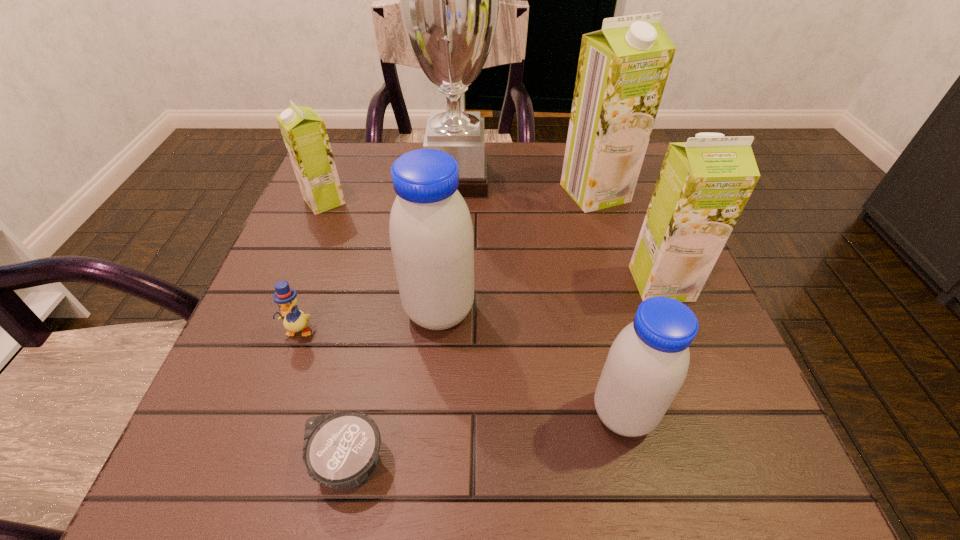
This screenshot has width=960, height=540. Identify the location of free space that satisfies the following two spatial constraints: 1. at the front view of the right blue soya milk; 2. on the right side of the tallest object. (443, 414).

This screenshot has width=960, height=540. I want to click on vacant space that satisfies the following two spatial constraints: 1. at the front view of the tallest object; 2. on the back side of the tallest soya milk, so click(456, 193).

Identify the location of free space that satisfies the following two spatial constraints: 1. at the front view of the trophy cup; 2. on the right side of the nearest green soya milk. (450, 283).